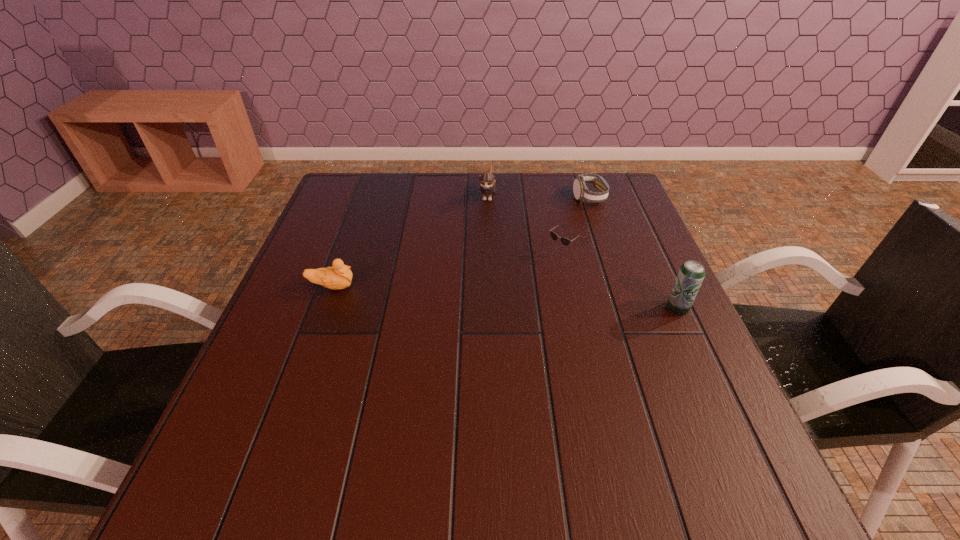
The height and width of the screenshot is (540, 960). I want to click on the fourth farthest object, so click(339, 276).

Identify the location of duckling. (339, 276).

Where is `the tallest object`? the tallest object is located at coordinates (691, 274).

I want to click on the rightmost object, so click(691, 274).

Find the location of `watch`. watch is located at coordinates (581, 192).

I want to click on the third object from right to left, so click(x=565, y=241).

Where is `sunglasses`? The image size is (960, 540). sunglasses is located at coordinates (565, 241).

Locate an element on the screen. The image size is (960, 540). kitten is located at coordinates (487, 181).

Identify the location of the fourth shortest object. (487, 181).

Image resolution: width=960 pixels, height=540 pixels. Identify the location of free space located on the face of the leftmost object. (444, 287).